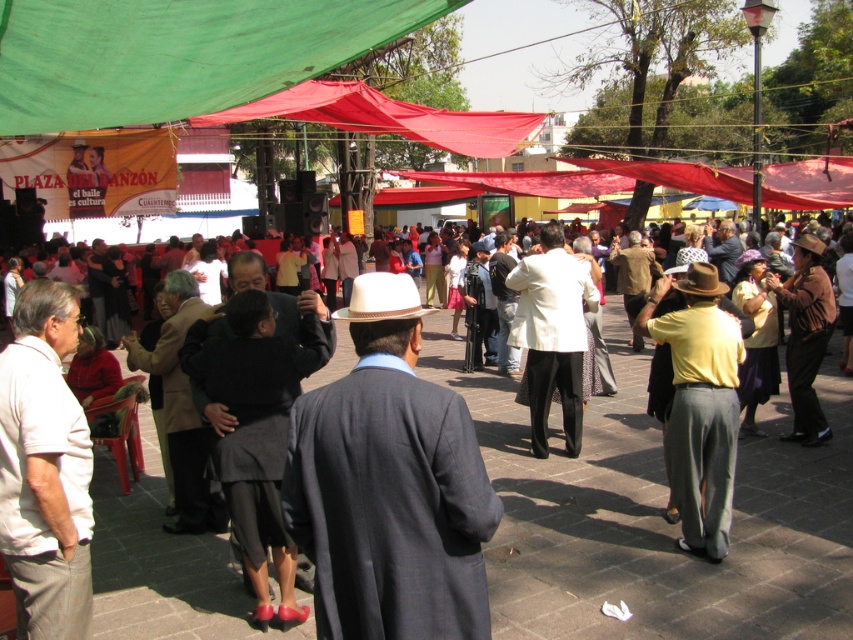
Identify the location of green fabric canopy at upper left. The height and width of the screenshot is (640, 853). (177, 52).

Is point (114, 67) farther from camera compared to point (576, 330)?

No.

Locate an element on the screen. This screenshot has height=640, width=853. green fabric canopy at upper left is located at coordinates (177, 52).

Based on the photo, between matte black suit at center and green fabric canopy at upper left, which one appears on the right side from the viewer's perspective?

matte black suit at center is more to the right.

Is matte black suit at center to the right of green fabric canopy at upper left from the viewer's perspective?

Correct, you'll find matte black suit at center to the right of green fabric canopy at upper left.

Is point (718, 604) behind point (169, 104)?

No, (718, 604) is closer to viewer.

I want to click on matte black suit at center, so tap(654, 515).

Is point (590, 552) less distant than point (537, 371)?

That is True.

Based on the photo, who is lower down, matte black suit at center or white matte suit at center?

matte black suit at center is lower down.

Locate an element on the screen. This screenshot has height=640, width=853. matte black suit at center is located at coordinates (654, 515).